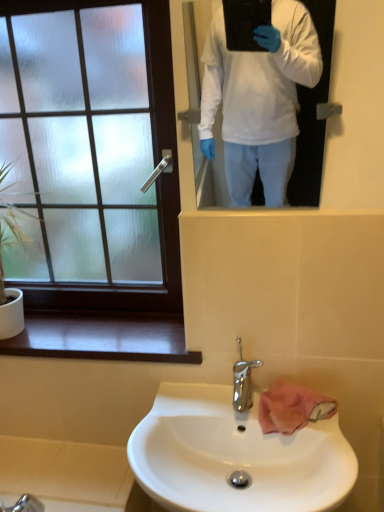
Question: Is white glossy mirror at upper center to the left or to the right of chrome metallic faucet at center in the image?

Choices:
 (A) right
 (B) left

Answer: (A)

Question: In terms of width, does white glossy mirror at upper center look wider or thinner when compared to chrome metallic faucet at center?

Choices:
 (A) wide
 (B) thin

Answer: (B)

Question: Which is farther from the white glossy mirror at upper center?

Choices:
 (A) white glossy sink at lower center
 (B) green leafy plant at left
 (C) pink fabric hand towel at sink
 (D) frosted glass window at upper left
 (E) chrome metallic faucet at center

Answer: (E)

Question: Considering the real-world distances, which object is farthest from the green leafy plant at left?

Choices:
 (A) white glossy sink at lower center
 (B) frosted glass window at upper left
 (C) chrome metallic faucet at center
 (D) pink fabric hand towel at sink
 (E) white glossy mirror at upper center

Answer: (E)